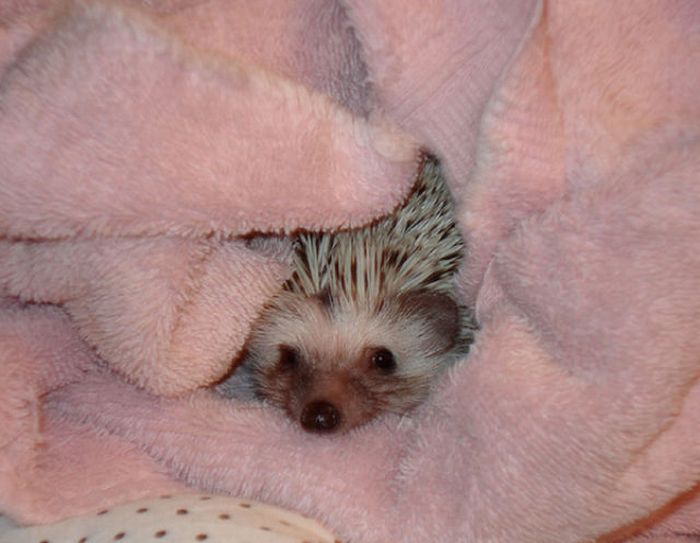
This screenshot has width=700, height=543. I want to click on dark spot on blanket, so click(326, 46).